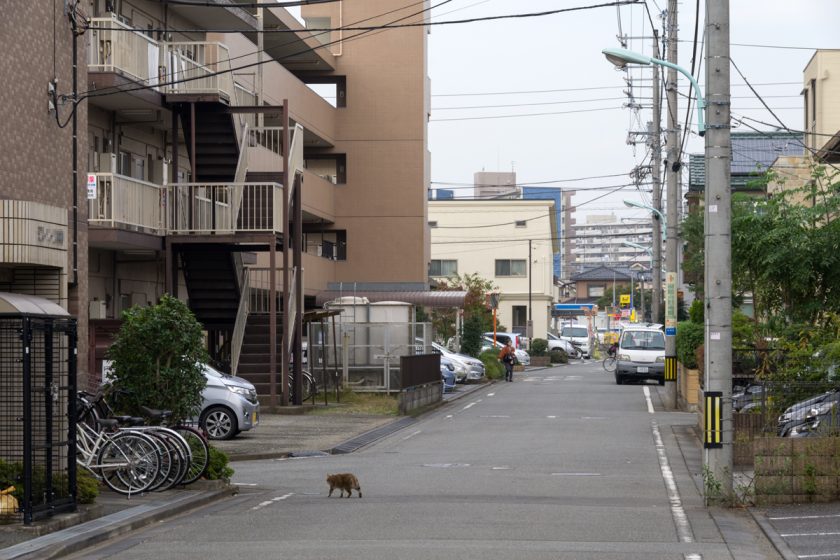
Locate an element on the screen. The image size is (840, 560). wall is located at coordinates (408, 169).